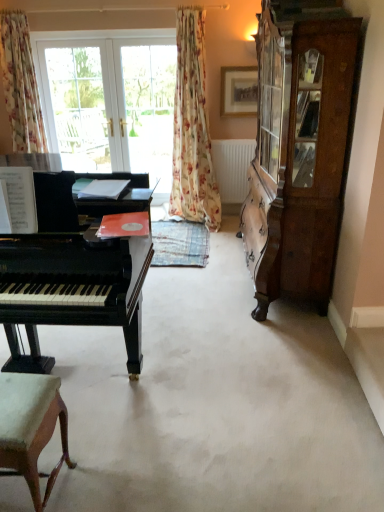
Where is `vacant area located to the right-hand side of light brown wood chair at lower left`? The image size is (384, 512). vacant area located to the right-hand side of light brown wood chair at lower left is located at coordinates (102, 474).